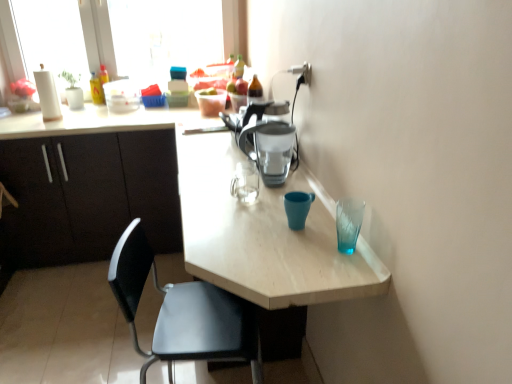
Measure the distance between point (237,359) and camera.

A distance of 1.32 meters exists between point (237,359) and camera.

Locate an element on the screen. The width and height of the screenshot is (512, 384). matte black cabinets at left is located at coordinates (89, 194).

This screenshot has width=512, height=384. What are the coordinates of `black plastic chair at lower left` in the screenshot? It's located at (183, 312).

From a real-world perspective, is transparent plastic window at upper left over black plastic chair at lower left?

Yes, from a real-world perspective, transparent plastic window at upper left is above black plastic chair at lower left.

From the picture: Does transparent plastic window at upper left have a larger size compared to black plastic chair at lower left?

Incorrect, transparent plastic window at upper left is not larger than black plastic chair at lower left.

Considering the positions of point (62, 85) and point (227, 326), is point (62, 85) closer or farther from the camera than point (227, 326)?

Point (62, 85) is positioned farther from the camera compared to point (227, 326).

Is matte plastic coffee pot at center wider than transparent plastic window at upper left?

Yes, matte plastic coffee pot at center is wider than transparent plastic window at upper left.

Is the surface of matte plastic coffee pot at center in direct contact with transparent plastic window at upper left?

No, matte plastic coffee pot at center is not with transparent plastic window at upper left.

Is matte plastic coffee pot at center in front of transparent plastic window at upper left?

Yes, matte plastic coffee pot at center is closer to the camera.

Does point (249, 108) lie in front of point (99, 44)?

Yes.

Considering the positions of objects matte black cabinets at left and black plastic chair at lower left in the image provided, who is more to the right, matte black cabinets at left or black plastic chair at lower left?

black plastic chair at lower left.

Can you tell me how much matte black cabinets at left and black plastic chair at lower left differ in facing direction?

The facing directions of matte black cabinets at left and black plastic chair at lower left are 79.6 degrees apart.

From the image's perspective, which one is positioned lower, matte black cabinets at left or black plastic chair at lower left?

black plastic chair at lower left appears lower in the image.

Identify the location of chair in front of the matte black cabinets at left. point(183,312).

Is the position of matte black cabinets at left less distant than that of light wood table at center?

No, the depth of matte black cabinets at left is greater than that of light wood table at center.

Is matte black cabinets at left inside the boundaries of light wood table at center, or outside?

matte black cabinets at left is inside light wood table at center.

Which of these two, matte black cabinets at left or light wood table at center, stands shorter?

With less height is matte black cabinets at left.

From a real-world perspective, is matte black cabinets at left under light wood table at center?

Yes, from a real-world perspective, matte black cabinets at left is under light wood table at center.

Is black plastic chair at lower left directly adjacent to matte plastic coffee pot at center?

black plastic chair at lower left and matte plastic coffee pot at center are not in contact.

From the image's perspective, is black plastic chair at lower left above matte plastic coffee pot at center?

No, from the image's perspective, black plastic chair at lower left is not on top of matte plastic coffee pot at center.

Is black plastic chair at lower left surrounding matte plastic coffee pot at center?

No.

Is black plastic chair at lower left oriented towards matte plastic coffee pot at center?

No, black plastic chair at lower left is not aimed at matte plastic coffee pot at center.

Considering the sizes of objects matte black cabinets at left and matte plastic coffee pot at center in the image provided, who is shorter, matte black cabinets at left or matte plastic coffee pot at center?

Standing shorter between the two is matte plastic coffee pot at center.

Is point (96, 215) positioned before point (290, 71)?

That is False.

Does matte black cabinets at left touch matte plastic coffee pot at center?

There is a gap between matte black cabinets at left and matte plastic coffee pot at center.

Is matte black cabinets at left further to the viewer compared to matte plastic coffee pot at center?

Yes, matte black cabinets at left is behind matte plastic coffee pot at center.

From a real-world perspective, is matte plastic coffee pot at center on top of black plastic chair at lower left?

Yes, from a real-world perspective, matte plastic coffee pot at center is over black plastic chair at lower left

Considering the sizes of matte plastic coffee pot at center and black plastic chair at lower left in the image, is matte plastic coffee pot at center bigger or smaller than black plastic chair at lower left?

matte plastic coffee pot at center is smaller than black plastic chair at lower left.

From the image's perspective, which one is positioned lower, matte plastic coffee pot at center or black plastic chair at lower left?

black plastic chair at lower left, from the image's perspective.

How far apart are matte plastic coffee pot at center and black plastic chair at lower left?

matte plastic coffee pot at center and black plastic chair at lower left are 22.57 inches apart from each other.

Locate an element on the screen. The image size is (512, 384). window screen that appears on the left of black plastic chair at lower left is located at coordinates (113, 37).

What are the coordinates of `coffeepot below the transparent plastic window at upper left (from the image's perspective)` in the screenshot? It's located at (270, 137).

Based on their spatial positions, is transparent plastic window at upper left or matte plastic coffee pot at center closer to matte black cabinets at left?

transparent plastic window at upper left lies closer to matte black cabinets at left than the other object.

Estimate the real-world distances between objects in this image. Which object is further from light wood table at center, matte black cabinets at left or matte plastic coffee pot at center?

matte black cabinets at left is positioned further to the anchor light wood table at center.

Considering their positions, is matte plastic coffee pot at center positioned closer to matte black cabinets at left than transparent plastic window at upper left?

transparent plastic window at upper left.

Considering their positions, is transparent plastic window at upper left positioned closer to matte plastic coffee pot at center than black plastic chair at lower left?

Based on the image, black plastic chair at lower left appears to be nearer to matte plastic coffee pot at center.

Based on their spatial positions, is light wood table at center or black plastic chair at lower left closer to matte plastic coffee pot at center?

light wood table at center lies closer to matte plastic coffee pot at center than the other object.

Estimate the real-world distances between objects in this image. Which object is closer to transparent plastic window at upper left, matte plastic coffee pot at center or black plastic chair at lower left?

matte plastic coffee pot at center lies closer to transparent plastic window at upper left than the other object.

From the image, which object appears to be nearer to matte plastic coffee pot at center, black plastic chair at lower left or light wood table at center?

Among the two, light wood table at center is located nearer to matte plastic coffee pot at center.

Based on their spatial positions, is matte black cabinets at left or light wood table at center further from transparent plastic window at upper left?

The object further to transparent plastic window at upper left is matte black cabinets at left.

Image resolution: width=512 pixels, height=384 pixels. Identify the location of chair between light wood table at center and matte plastic coffee pot at center in the horizontal direction. (183, 312).

You are a GUI agent. You are given a task and a screenshot of the screen. Output one action in this format:
    pyautogui.click(x=<x>, y=<y>)
    Task: Click on the coffeepot between transparent plastic window at upper left and black plastic chair at lower left in the vertical direction
    This screenshot has height=384, width=512.
    Given the screenshot: What is the action you would take?
    pyautogui.click(x=270, y=137)

This screenshot has height=384, width=512. Find the location of `coffeepot positioned between black plastic chair at lower left and matte black cabinets at left from near to far`. coffeepot positioned between black plastic chair at lower left and matte black cabinets at left from near to far is located at coordinates (270, 137).

Find the location of a particular element. cabinetry between light wood table at center and transparent plastic window at upper left along the z-axis is located at coordinates (89, 194).